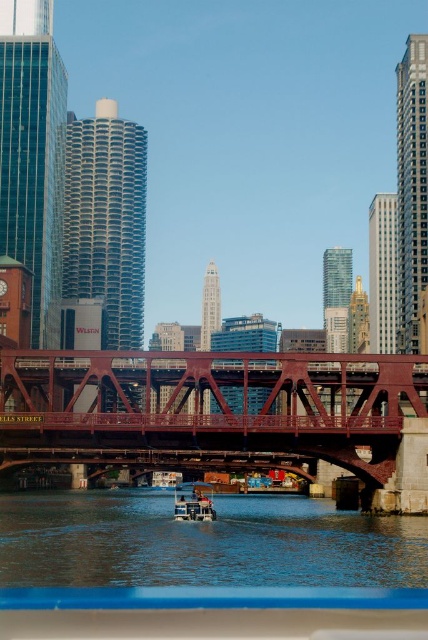
Is red steel bridge at center taller than blue water at center?

Yes.

Can you confirm if red steel bridge at center is bigger than blue water at center?

Correct, red steel bridge at center is larger in size than blue water at center.

Identify the location of red steel bridge at center. The width and height of the screenshot is (428, 640). [x=208, y=406].

How distant is red steel bridge at center from metallic blue boat at center?

red steel bridge at center and metallic blue boat at center are 12.55 meters apart from each other.

Measure the distance from red steel bridge at center to metallic blue boat at center.

red steel bridge at center and metallic blue boat at center are 12.55 meters apart.

What do you see at coordinates (208, 406) in the screenshot? I see `red steel bridge at center` at bounding box center [208, 406].

The width and height of the screenshot is (428, 640). In order to click on red steel bridge at center in this screenshot , I will do `click(208, 406)`.

Which is above, blue water at center or metallic blue boat at center?

blue water at center is higher up.

Does blue water at center have a larger size compared to metallic blue boat at center?

Yes.

Which is behind, point (53, 496) or point (213, 506)?

Positioned behind is point (53, 496).

The image size is (428, 640). I want to click on blue water at center, so click(204, 541).